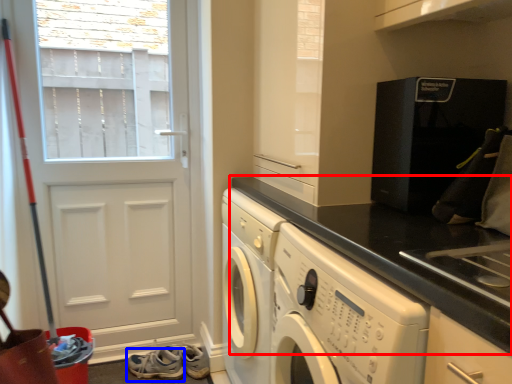
Question: Among these objects, which one is farthest to the camera, countertop (highlighted by a red box) or shoe (highlighted by a blue box)?

Choices:
 (A) countertop
 (B) shoe

Answer: (B)